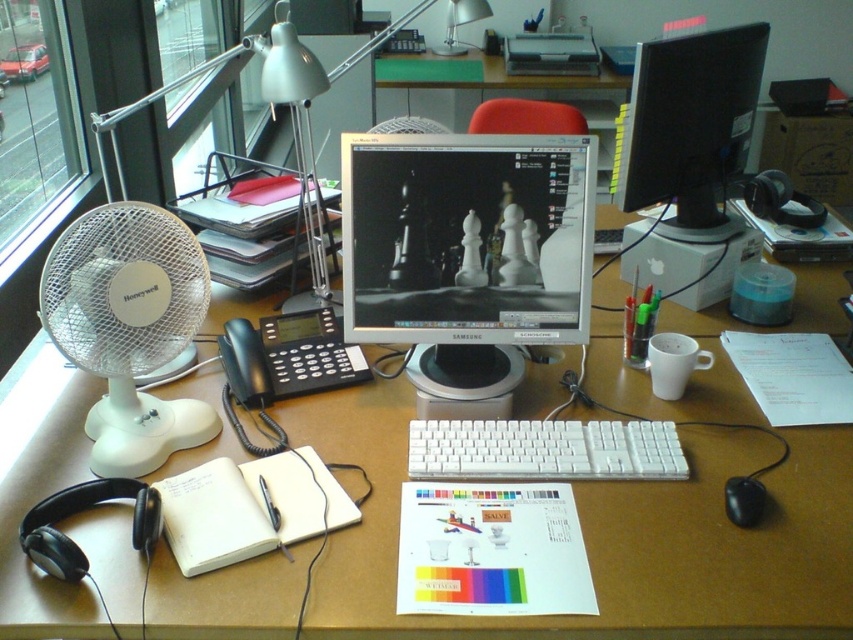
This screenshot has width=853, height=640. What do you see at coordinates (610, 536) in the screenshot?
I see `white plastic desk at center` at bounding box center [610, 536].

Can you confirm if white plastic desk at center is shorter than black plastic mouse at lower right?

No, white plastic desk at center is not shorter than black plastic mouse at lower right.

Is point (387, 602) positioned before point (762, 508)?

Yes, point (387, 602) is in front of point (762, 508).

Where is `white plastic desk at center`? This screenshot has width=853, height=640. white plastic desk at center is located at coordinates (610, 536).

Can you confirm if white plastic fan at left is shorter than black glossy monitor at upper right?

Correct, white plastic fan at left is not as tall as black glossy monitor at upper right.

What do you see at coordinates (129, 326) in the screenshot? I see `white plastic fan at left` at bounding box center [129, 326].

I want to click on white plastic fan at left, so click(129, 326).

This screenshot has height=640, width=853. What are the coordinates of `white plastic fan at left` in the screenshot? It's located at (129, 326).

Is satin black monitor at center smaller than white plastic keyboard at center?

No, satin black monitor at center is not smaller than white plastic keyboard at center.

Does satin black monitor at center appear under white plastic keyboard at center?

Incorrect, satin black monitor at center is not positioned below white plastic keyboard at center.

In order to click on satin black monitor at center in this screenshot , I will do `click(467, 252)`.

Identify the location of satin black monitor at center. (467, 252).